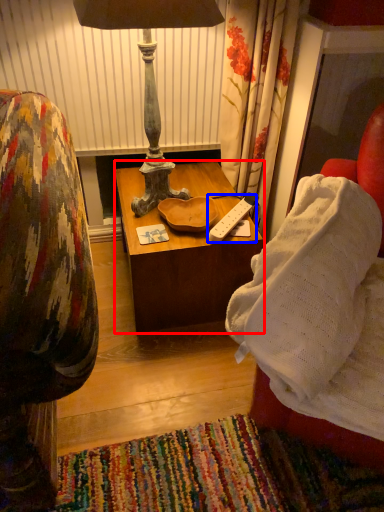
Question: Which point is further to the camera, table (highlighted by a red box) or remote (highlighted by a blue box)?

Choices:
 (A) table
 (B) remote

Answer: (B)